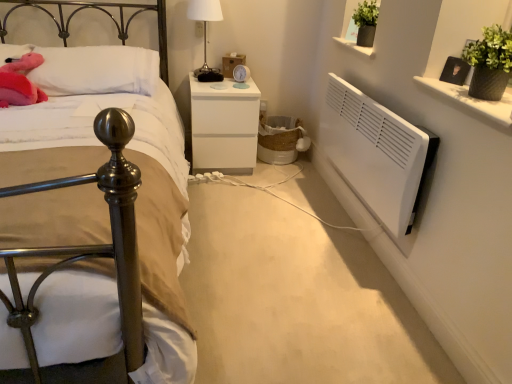
At what (x,y) coordinates should I click in order to perform the action: click on white glossy table lamp at upper center. Please return your answer as a coordinate pair (x, y). The width and height of the screenshot is (512, 384). Looking at the image, I should click on (205, 33).

What do you see at coordinates (20, 82) in the screenshot?
I see `fluffy pink plush at upper left` at bounding box center [20, 82].

Measure the distance between point (91,80) and camera.

Point (91,80) and camera are 7.39 feet apart.

This screenshot has height=384, width=512. What do you see at coordinates (96, 70) in the screenshot? I see `white soft pillow at upper left` at bounding box center [96, 70].

The image size is (512, 384). I want to click on white glossy vase at upper right, so click(x=473, y=100).

In order to click on white glossy table lamp at upper center in this screenshot , I will do `click(205, 33)`.

Considering the relative sizes of white soft pillow at upper left and fluffy pink plush at upper left in the image provided, is white soft pillow at upper left bigger than fluffy pink plush at upper left?

Yes.

Would you say white soft pillow at upper left is to the left or to the right of fluffy pink plush at upper left in the picture?

In the image, white soft pillow at upper left appears on the right side of fluffy pink plush at upper left.

From the image's perspective, is white soft pillow at upper left above or below fluffy pink plush at upper left?

white soft pillow at upper left is above fluffy pink plush at upper left.

Are white soft pillow at upper left and fluffy pink plush at upper left making contact?

No, white soft pillow at upper left is not making contact with fluffy pink plush at upper left.

Would you say white glossy vase at upper right is to the left or to the right of white soft pillow at upper left in the picture?

In the image, white glossy vase at upper right appears on the right side of white soft pillow at upper left.

In the scene shown: Between white glossy vase at upper right and white soft pillow at upper left, which one has smaller width?

Thinner between the two is white glossy vase at upper right.

Considering the relative sizes of white glossy vase at upper right and white soft pillow at upper left in the image provided, is white glossy vase at upper right bigger than white soft pillow at upper left?

No, white glossy vase at upper right is not bigger than white soft pillow at upper left.

Is white soft pillow at upper left further to camera compared to white glossy vase at upper right?

Yes, the depth of white soft pillow at upper left is greater than that of white glossy vase at upper right.

Does white soft pillow at upper left have a smaller size compared to white glossy vase at upper right?

No, white soft pillow at upper left is not smaller than white glossy vase at upper right.

Where is `window sill that appears below the white soft pillow at upper left (from the image's perspective)`? window sill that appears below the white soft pillow at upper left (from the image's perspective) is located at coordinates (473, 100).

Which is behind, point (444, 89) or point (24, 236)?

Positioned behind is point (444, 89).

Can you tell me how much white glossy vase at upper right and metallic bed at left differ in facing direction?

white glossy vase at upper right and metallic bed at left are facing 88 degrees away from each other.

Is white glossy vase at upper right completely or partially outside of metallic bed at left?

Yes, white glossy vase at upper right is not within metallic bed at left.

Does white glossy table lamp at upper center contain white glossy vase at upper right?

Actually, white glossy vase at upper right is outside white glossy table lamp at upper center.

From the image's perspective, which object appears higher, white glossy table lamp at upper center or white glossy vase at upper right?

white glossy table lamp at upper center.

I want to click on bedside lamp that is on the left side of white glossy vase at upper right, so click(x=205, y=33).

Does white glossy table lamp at upper center have a lesser height compared to white glossy vase at upper right?

In fact, white glossy table lamp at upper center may be taller than white glossy vase at upper right.

How different are the orientations of fluffy pink plush at upper left and metallic bed at left in degrees?

6.86 degrees.

Based on their positions, is fluffy pink plush at upper left located to the left or right of metallic bed at left?

Clearly, fluffy pink plush at upper left is on the left of metallic bed at left in the image.

Does fluffy pink plush at upper left have a greater width compared to metallic bed at left?

In fact, fluffy pink plush at upper left might be narrower than metallic bed at left.

In terms of height, does fluffy pink plush at upper left look taller or shorter compared to metallic bed at left?

fluffy pink plush at upper left is shorter than metallic bed at left.

How distant is white matte nightstand at center from white glossy vase at upper right?

The distance of white matte nightstand at center from white glossy vase at upper right is 4.13 feet.

From a real-world perspective, is white matte nightstand at center positioned above or below white glossy vase at upper right?

From a real-world perspective, white matte nightstand at center is physically below white glossy vase at upper right.

Consider the image. Is white matte nightstand at center oriented towards white glossy vase at upper right?

No, white matte nightstand at center is not facing towards white glossy vase at upper right.

Considering the relative sizes of white matte nightstand at center and white glossy vase at upper right in the image provided, is white matte nightstand at center smaller than white glossy vase at upper right?

Incorrect, white matte nightstand at center is not smaller in size than white glossy vase at upper right.

The image size is (512, 384). Find the location of `animal below the white soft pillow at upper left (from a real-world perspective)`. animal below the white soft pillow at upper left (from a real-world perspective) is located at coordinates (20, 82).

I want to click on pillow located behind the white glossy vase at upper right, so click(96, 70).

Estimate the real-world distances between objects in this image. Which object is closer to white soft pillow at upper left, white glossy vase at upper right or white matte nightstand at center?

Based on the image, white matte nightstand at center appears to be nearer to white soft pillow at upper left.

Based on their spatial positions, is white glossy table lamp at upper center or metallic bed at left closer to white matte nightstand at center?

white glossy table lamp at upper center.

When comparing their distances from white soft pillow at upper left, does white glossy table lamp at upper center or metallic bed at left seem further?

white glossy table lamp at upper center is positioned further to the anchor white soft pillow at upper left.

Considering their positions, is white glossy vase at upper right positioned further to fluffy pink plush at upper left than white glossy table lamp at upper center?

Based on the image, white glossy vase at upper right appears to be further to fluffy pink plush at upper left.

Based on their spatial positions, is metallic bed at left or white soft pillow at upper left closer to white glossy table lamp at upper center?

Based on the image, white soft pillow at upper left appears to be nearer to white glossy table lamp at upper center.

Based on their spatial positions, is fluffy pink plush at upper left or white matte nightstand at center closer to metallic bed at left?

fluffy pink plush at upper left is positioned closer to the anchor metallic bed at left.

Looking at the image, which one is located further to white soft pillow at upper left, white glossy table lamp at upper center or white matte nightstand at center?

white glossy table lamp at upper center.

Looking at the image, which one is located closer to white soft pillow at upper left, white glossy vase at upper right or fluffy pink plush at upper left?

fluffy pink plush at upper left.

At what (x,y) coordinates should I click in order to perform the action: click on pillow between metallic bed at left and white glossy vase at upper right from left to right. Please return your answer as a coordinate pair (x, y). The width and height of the screenshot is (512, 384). Looking at the image, I should click on (96, 70).

In order to click on bedside lamp between fluffy pink plush at upper left and white glossy vase at upper right in this screenshot , I will do `click(205, 33)`.

Find the location of `animal positioned between metallic bed at left and white soft pillow at upper left from near to far`. animal positioned between metallic bed at left and white soft pillow at upper left from near to far is located at coordinates (20, 82).

Identify the location of bedside lamp between white soft pillow at upper left and white glossy vase at upper right. The height and width of the screenshot is (384, 512). (205, 33).